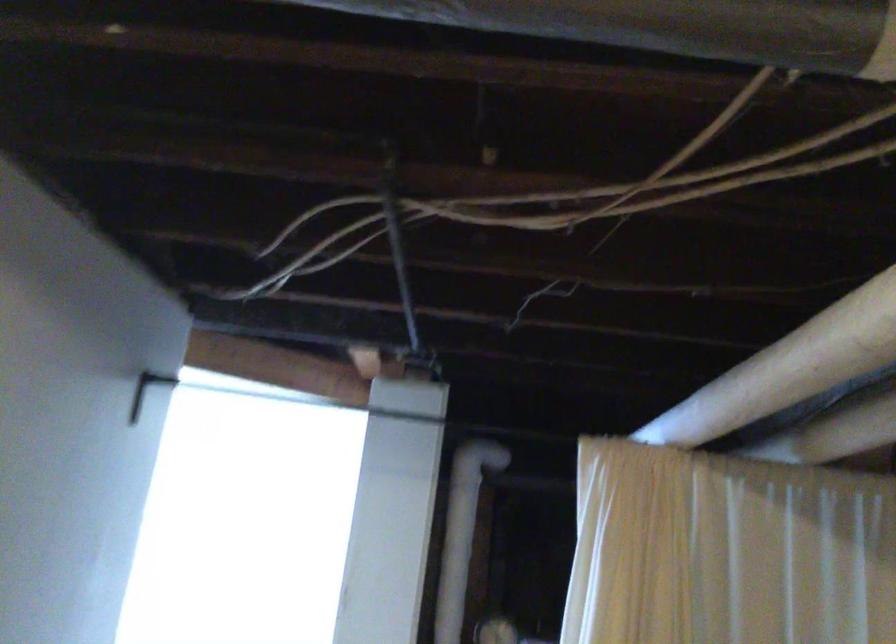
The images are taken continuously from a first-person perspective. In which direction is your viewpoint rotating?

The camera's rotation is toward left-up.